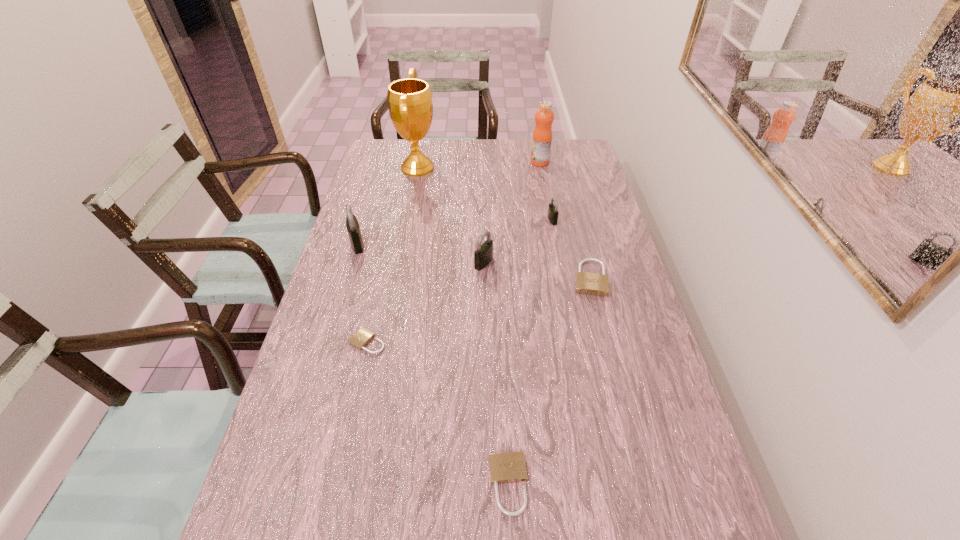
What are the coordinates of `vacant space that satisfies the following two spatial constraints: 1. on the front side of the fruit juice; 2. on the front-facing side of the tallest object` in the screenshot? It's located at (540, 168).

In order to click on free spot that satisfies the following two spatial constraints: 1. on the back side of the rightmost beige padlock; 2. on the front-facing side of the gold award in this screenshot , I will do `click(562, 168)`.

At what (x,y) coordinates should I click in order to perform the action: click on free location that satisfies the following two spatial constraints: 1. on the back side of the fifth padlock from right to left; 2. on the left side of the fruit juice. Please return your answer as a coordinate pair (x, y). The width and height of the screenshot is (960, 540). Looking at the image, I should click on (407, 162).

Locate an element on the screen. Image resolution: width=960 pixels, height=540 pixels. free spot that satisfies the following two spatial constraints: 1. on the front-facing side of the gold award; 2. on the left side of the second beige padlock from left to right is located at coordinates (358, 484).

I want to click on free space that satisfies the following two spatial constraints: 1. on the back side of the fifth tallest padlock; 2. on the left side of the rightmost beige padlock, so click(499, 278).

Locate an element on the screen. This screenshot has width=960, height=540. vacant area that satisfies the following two spatial constraints: 1. on the front-facing side of the gold award; 2. on the back side of the second padlock from right to left is located at coordinates pyautogui.click(x=408, y=220).